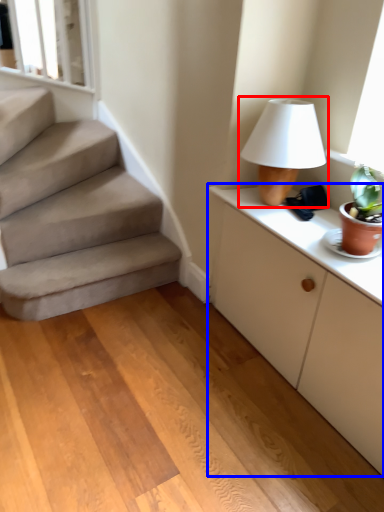
Question: Which point is closer to the camera, table lamp (highlighted by a red box) or cabinetry (highlighted by a blue box)?

Choices:
 (A) table lamp
 (B) cabinetry

Answer: (B)